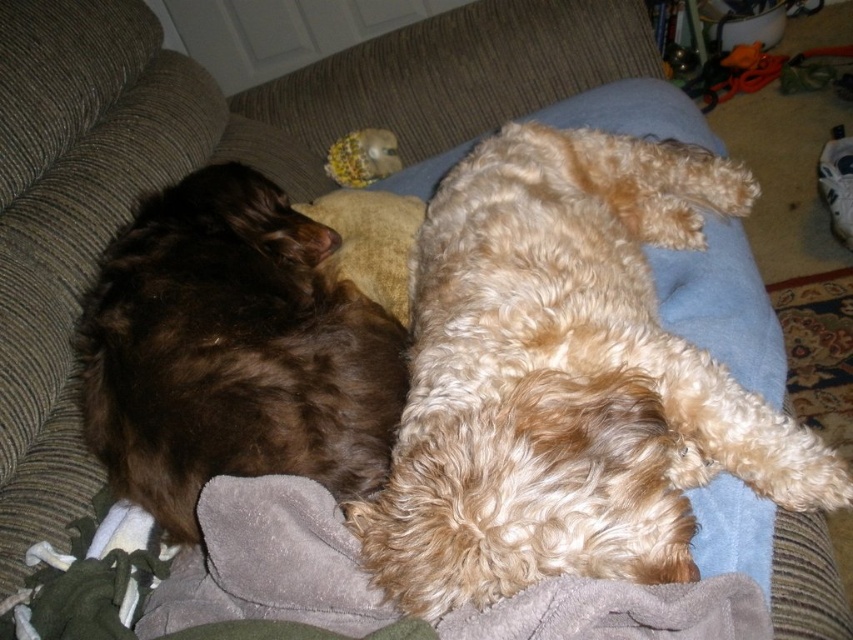
Question: Does curly golden fur dog at center appear under brown fluffy dog at left?

Choices:
 (A) no
 (B) yes

Answer: (A)

Question: Does curly golden fur dog at center have a lesser width compared to brown fluffy dog at left?

Choices:
 (A) yes
 (B) no

Answer: (B)

Question: Which object is farther from the camera taking this photo?

Choices:
 (A) curly golden fur dog at center
 (B) brown fluffy dog at left

Answer: (B)

Question: Can you confirm if curly golden fur dog at center is positioned to the right of brown fluffy dog at left?

Choices:
 (A) no
 (B) yes

Answer: (B)

Question: Which point is closer to the camera?

Choices:
 (A) (341, 404)
 (B) (514, 344)

Answer: (B)